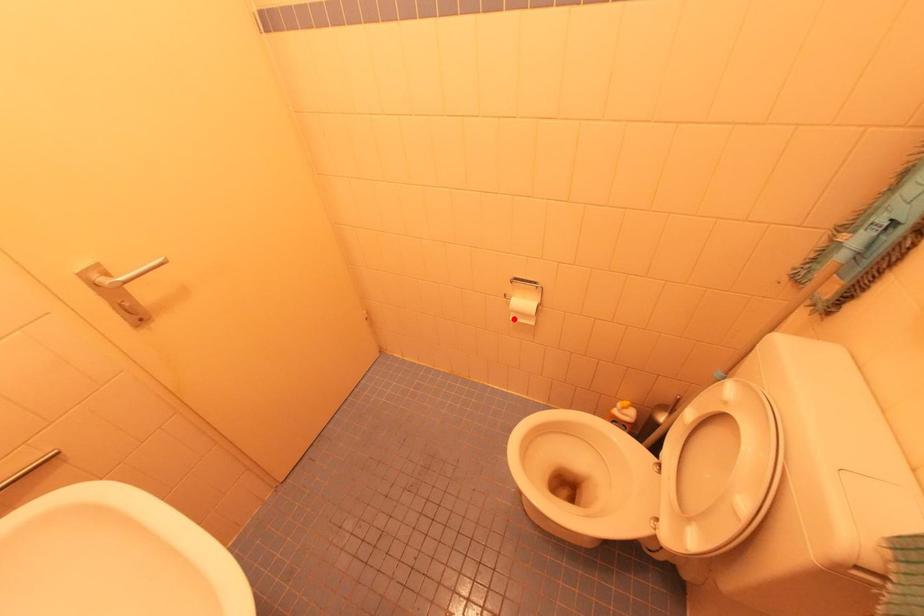
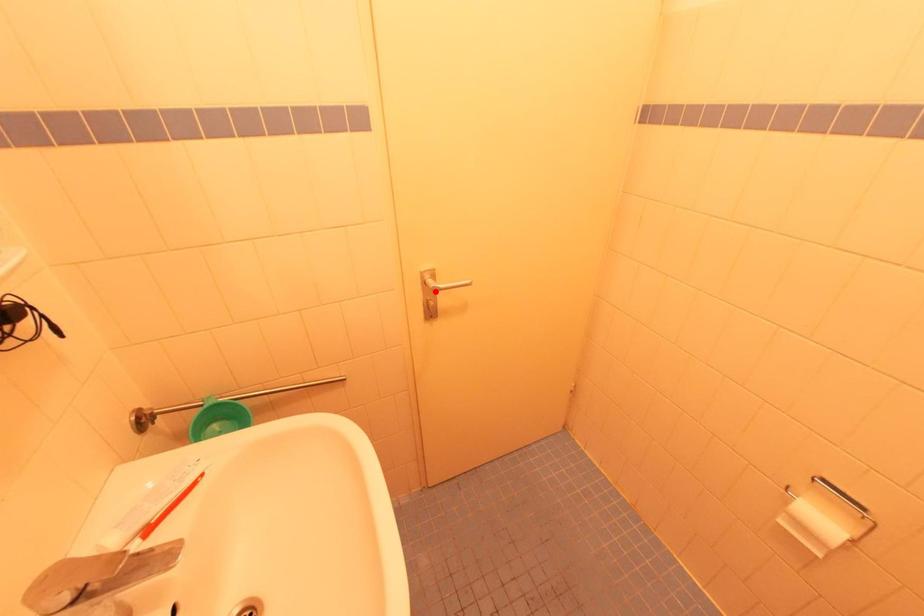
I am providing you with two images of the same scene from different viewpoints. A red point is marked on the first image and another point is marked on the second image. Is the marked point in image1 the same physical position as the marked point in image2?

No